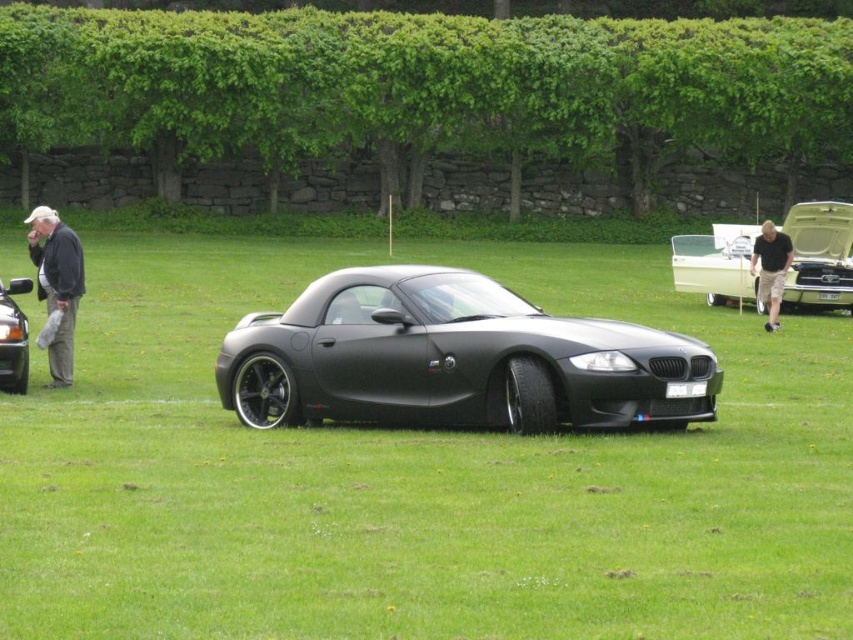
You are a delivery person who needs to park a 5.5 meter long truck between the green grass at center and the matte black car at center. Can you fit the truck in the space between them?

The space between the green grass at center and the matte black car at center is 6.15 meters. Since the truck is 5.5 meters long, it can fit in the space between them as there is enough room.

You are a photographer setting up a shot of the black BMW Z4 sports car. You notice the green grass at center and the gray fabric pants at left in the background. Which object takes up more area in the image?

The gray fabric pants at left take up more area in the image than the green grass at center.

You are standing at the center of the grassy area and want to walk to the point marked as point (416, 476). What will you step on when you reach that point?

When you reach point (416, 476), you will step on green grass at center.